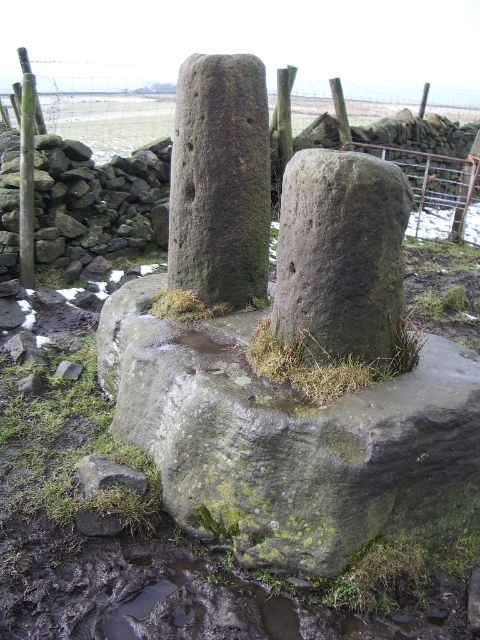
Who is shorter, green mossy stone at center or green mossy rock at lower left?

green mossy rock at lower left

Does green mossy stone at center appear on the right side of green mossy rock at lower left?

Correct, you'll find green mossy stone at center to the right of green mossy rock at lower left.

Does point (278, 236) lie behind point (90, 468)?

Yes, point (278, 236) is behind point (90, 468).

Locate an element on the screen. This screenshot has height=640, width=480. green mossy stone at center is located at coordinates (340, 253).

Is green mossy grass at center in front of green mossy rock at lower left?

Yes, green mossy grass at center is in front of green mossy rock at lower left.

Is green mossy grass at center wider than green mossy rock at lower left?

Yes, green mossy grass at center is wider than green mossy rock at lower left.

Which is behind, point (260, 362) or point (93, 465)?

Positioned behind is point (93, 465).

I want to click on green mossy grass at center, so click(326, 360).

Does green mossy rock at center have a greater width compared to smooth wooden post at left?

Indeed, green mossy rock at center has a greater width compared to smooth wooden post at left.

Does green mossy rock at center appear under smooth wooden post at left?

Correct, green mossy rock at center is located below smooth wooden post at left.

I want to click on green mossy rock at center, so click(x=290, y=440).

Locate an element on the screen. green mossy rock at center is located at coordinates (290, 440).